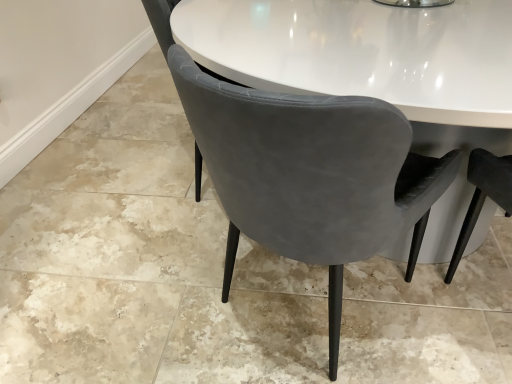
This screenshot has height=384, width=512. Find the location of `vacant region to the left of suede gray chair at center`. vacant region to the left of suede gray chair at center is located at coordinates (140, 291).